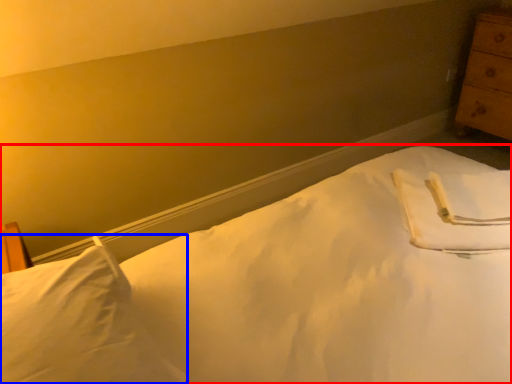
Question: Among these objects, which one is farthest to the camera, bed (highlighted by a red box) or pillow (highlighted by a blue box)?

Choices:
 (A) bed
 (B) pillow

Answer: (B)